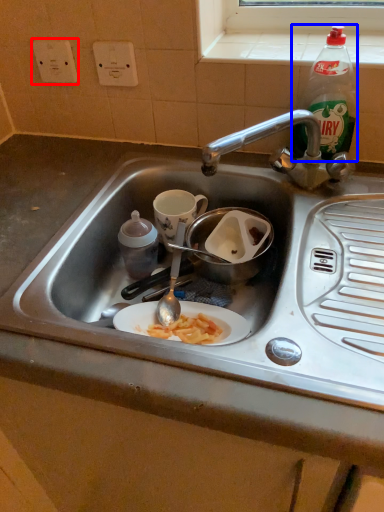
Question: Which point is closer to the camera, electric outlet (highlighted by a red box) or bottle (highlighted by a blue box)?

Choices:
 (A) electric outlet
 (B) bottle

Answer: (B)